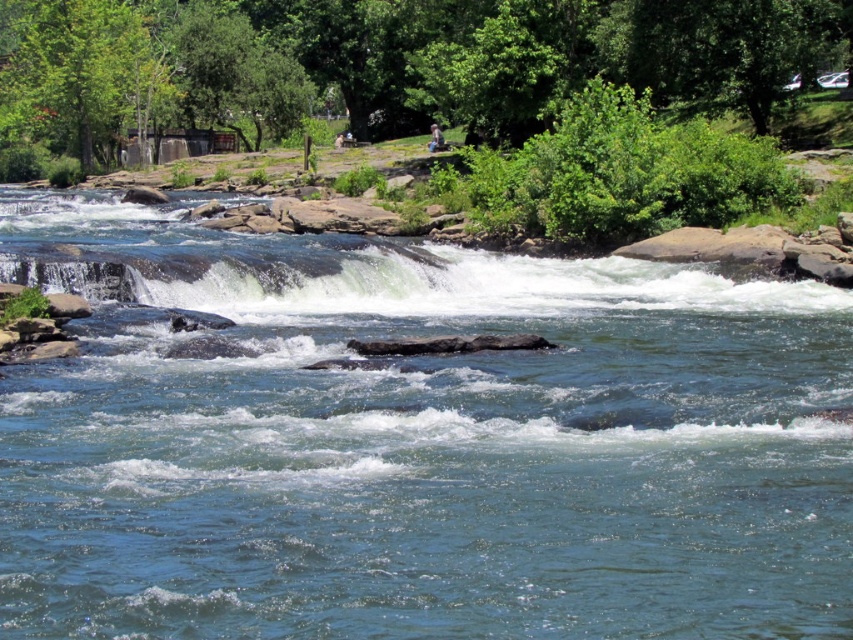
Question: Does clear blue water at center have a lesser width compared to green leafy tree at upper center?

Choices:
 (A) yes
 (B) no

Answer: (A)

Question: Which of the following is the farthest from the observer?

Choices:
 (A) (397, 109)
 (B) (849, 512)

Answer: (A)

Question: Where is clear blue water at center located in relation to green leafy tree at upper center in the image?

Choices:
 (A) above
 (B) below

Answer: (B)

Question: Among these objects, which one is nearest to the camera?

Choices:
 (A) green leafy tree at upper center
 (B) clear blue water at center

Answer: (B)

Question: Can you confirm if clear blue water at center is smaller than green leafy tree at upper center?

Choices:
 (A) no
 (B) yes

Answer: (B)